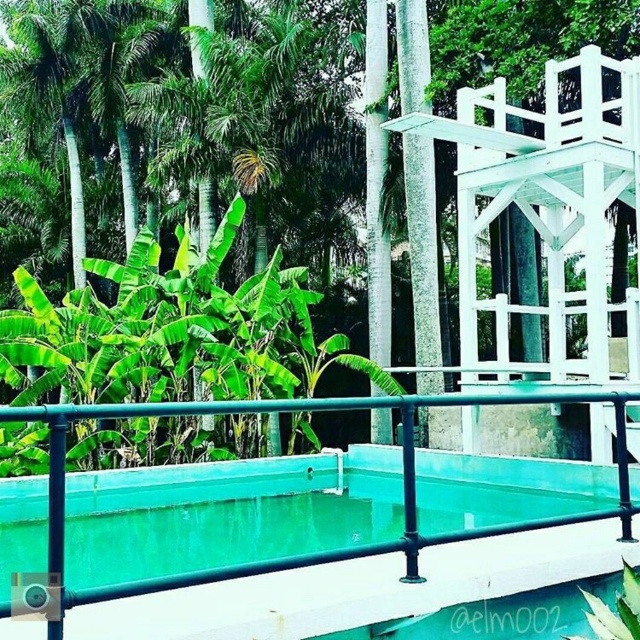
Is teal glossy pool at center above green leafy tree at center?

No.

How much distance is there between teal glossy pool at center and green leafy tree at center?

The distance of teal glossy pool at center from green leafy tree at center is 4.33 meters.

This screenshot has width=640, height=640. Describe the element at coordinates (273, 524) in the screenshot. I see `teal glossy pool at center` at that location.

Locate an element on the screen. This screenshot has width=640, height=640. teal glossy pool at center is located at coordinates (273, 524).

Can you confirm if teal glossy pool at center is positioned to the left of white painted wood gazebo at upper right?

Correct, you'll find teal glossy pool at center to the left of white painted wood gazebo at upper right.

What do you see at coordinates (273, 524) in the screenshot?
I see `teal glossy pool at center` at bounding box center [273, 524].

Between point (257, 504) and point (525, 205), which one is positioned in front?

Point (257, 504)

You are a GUI agent. You are given a task and a screenshot of the screen. Output one action in this format:
    pyautogui.click(x=<x>, y=<y>)
    Task: Click on the teal glossy pool at center
    
    Given the screenshot: What is the action you would take?
    pyautogui.click(x=273, y=524)

This screenshot has height=640, width=640. Describe the element at coordinates (545, 214) in the screenshot. I see `white painted wood gazebo at upper right` at that location.

Who is lower down, white painted wood gazebo at upper right or green leafy tree at center?

white painted wood gazebo at upper right

Describe the element at coordinates (545, 214) in the screenshot. The image size is (640, 640). I see `white painted wood gazebo at upper right` at that location.

Identify the location of white painted wood gazebo at upper right. Image resolution: width=640 pixels, height=640 pixels. (545, 214).